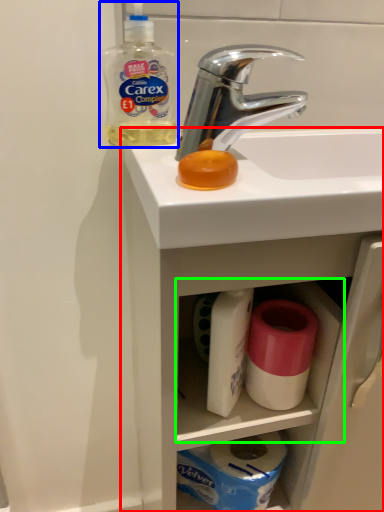
Question: Based on their relative distances, which object is farther from bathroom cabinet (highlighted by a red box)? Choose from cleaning product (highlighted by a blue box) and cabinet (highlighted by a green box).

Choices:
 (A) cleaning product
 (B) cabinet

Answer: (A)